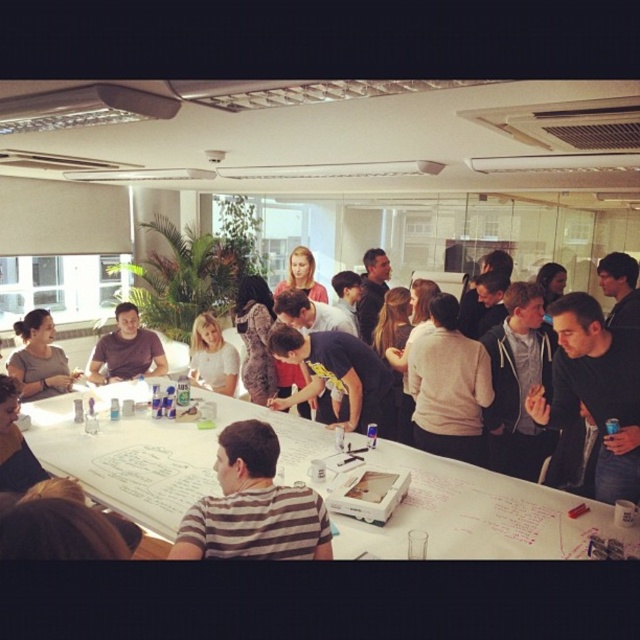
Which is behind, point (156, 348) or point (204, 385)?

Point (204, 385)

Is matte brown shirt at center thinner than light brown hair at center?

Incorrect, matte brown shirt at center's width is not less than light brown hair at center's.

Find the location of a particular element. matte brown shirt at center is located at coordinates (125, 349).

I want to click on white paperboard at center, so click(474, 515).

Who is higher up, white paperboard at center or matte brown shirt at center?

matte brown shirt at center

What do you see at coordinates (474, 515) in the screenshot? I see `white paperboard at center` at bounding box center [474, 515].

Locate an element on the screen. This screenshot has width=640, height=640. white paperboard at center is located at coordinates (474, 515).

Does white paperboard at center have a greater height compared to matte black shirt at center?

In fact, white paperboard at center may be shorter than matte black shirt at center.

Which is behind, point (141, 445) or point (54, 355)?

The point (54, 355) is more distant.

Where is `white paperboard at center`? The width and height of the screenshot is (640, 640). white paperboard at center is located at coordinates (474, 515).